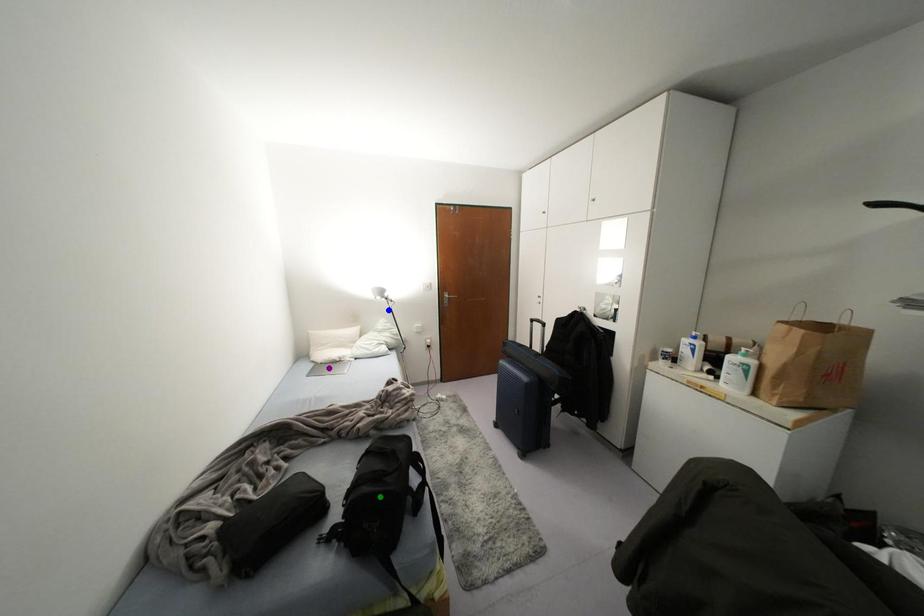
Order these from nearest to farthest:
A) green point
B) purple point
C) blue point

green point
purple point
blue point